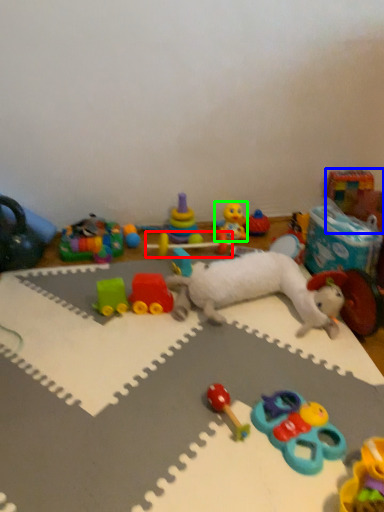
Question: Which object is positioned closest to toy (highlighted by a red box)? Select from toy (highlighted by a blue box) and toy (highlighted by a green box).

Choices:
 (A) toy
 (B) toy

Answer: (B)